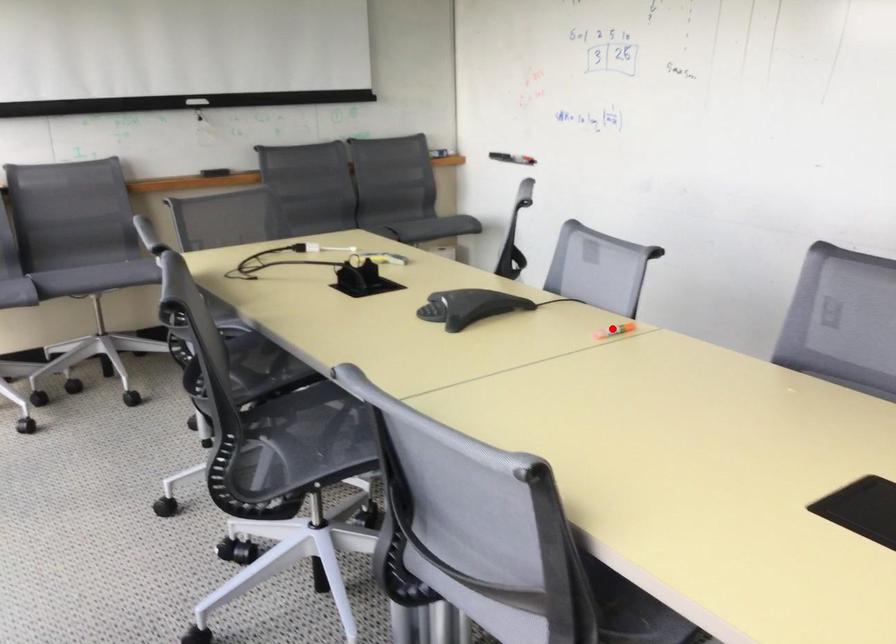
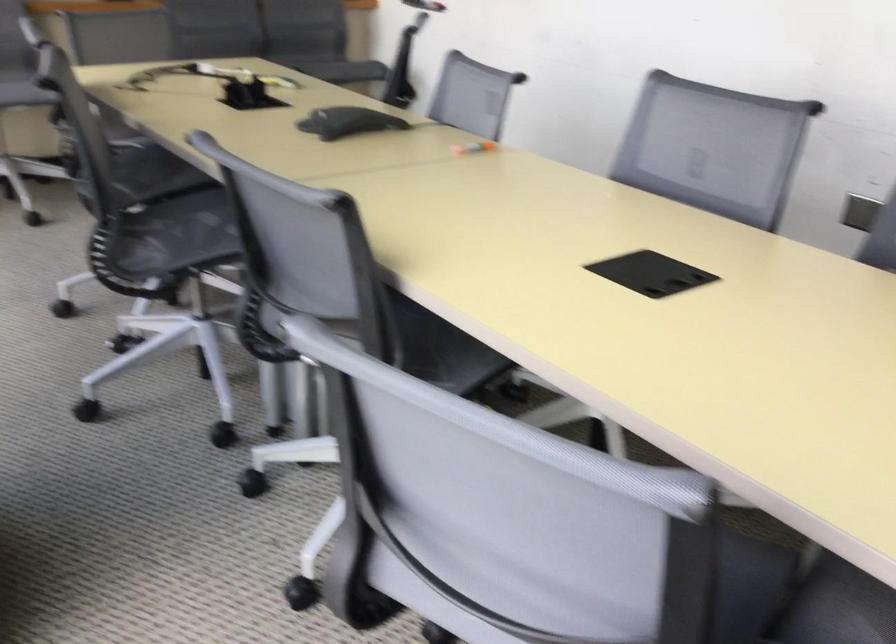
Question: I am providing you with two images of the same scene from different viewpoints. In image1, a red point is highlighted. Considering the same 3D point in image2, which of the following is correct?

Choices:
 (A) It is closer
 (B) It is farther

Answer: (B)